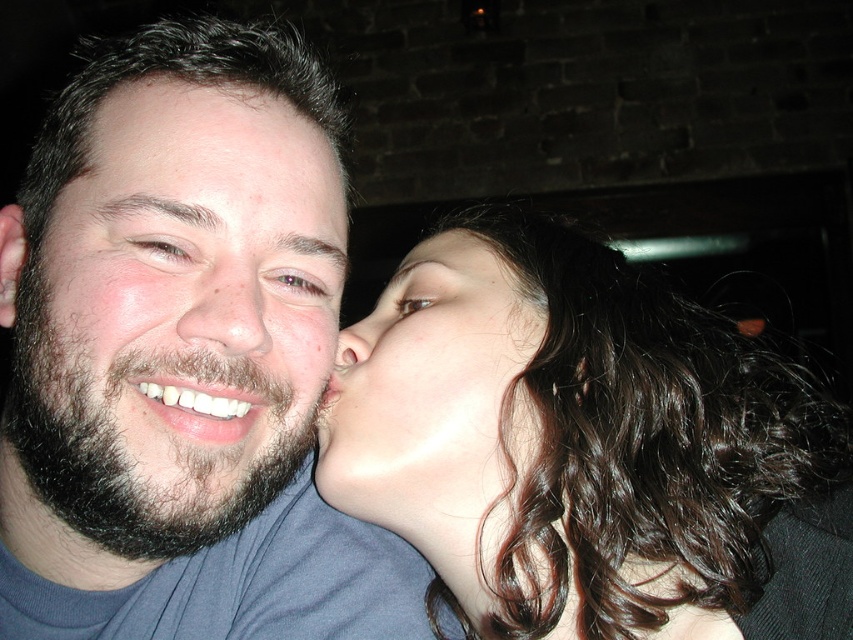
Question: Can you confirm if dark blue t-shirt at left is positioned above brown matte eye at center?

Choices:
 (A) no
 (B) yes

Answer: (A)

Question: Which point appears farthest from the camera in this image?

Choices:
 (A) (227, 132)
 (B) (306, 497)
 (C) (270, 292)

Answer: (B)

Question: Is dark brown skin at upper left to the left of matte skin nose at center from the viewer's perspective?

Choices:
 (A) no
 (B) yes

Answer: (B)

Question: Which object is farther from the camera taking this photo?

Choices:
 (A) brown matte eye at upper center
 (B) dark brown skin at upper left
 (C) dry skin nose at center

Answer: (A)

Question: Which of these objects is positioned farthest from the brown matte eye at upper left?

Choices:
 (A) brown matte eye at center
 (B) smooth skin face at center
 (C) brown matte eye at upper center

Answer: (B)

Question: Is brown matte eye at upper center positioned before brown matte eye at center?

Choices:
 (A) no
 (B) yes

Answer: (B)